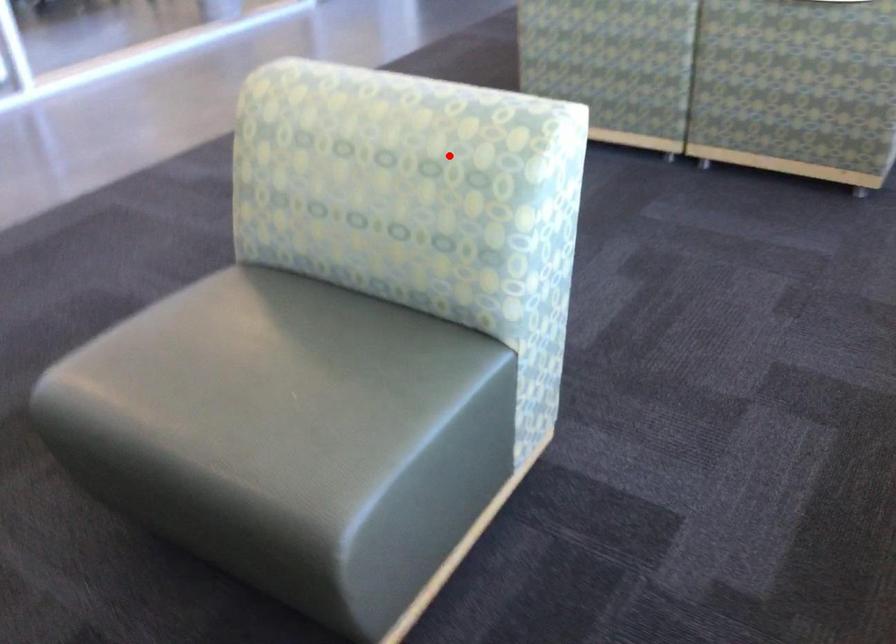
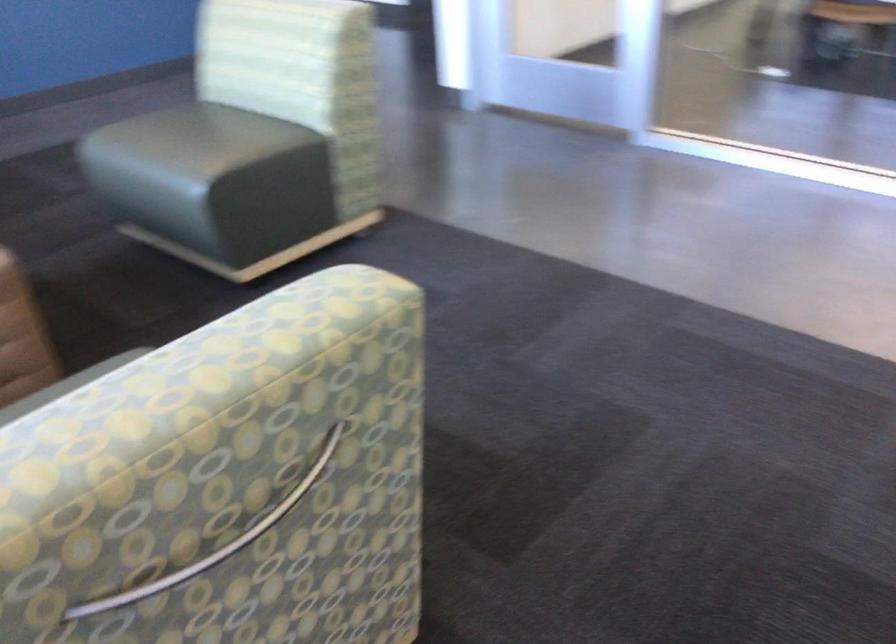
Question: I am providing you with two images of the same scene from different viewpoints. Image1 has a red point marked. In image2, the corresponding 3D location appears at what relative position? Reply with the corresponding letter.

Choices:
 (A) Closer
 (B) Farther

Answer: (A)